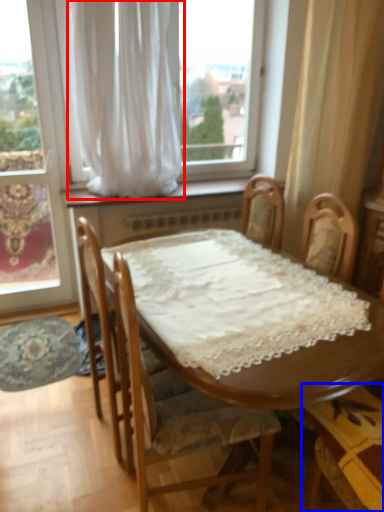
Question: Which of the following is the closest to the observer, curtain (highlighted by a red box) or chair (highlighted by a blue box)?

Choices:
 (A) curtain
 (B) chair

Answer: (B)